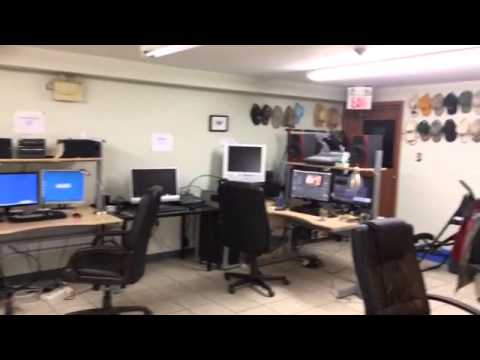
You are a GUI agent. You are given a task and a screenshot of the screen. Output one action in this format:
    pyautogui.click(x=<x>, y=<y>)
    Task: Click on the power strips
    The width and height of the screenshot is (480, 360).
    Given the screenshot: What is the action you would take?
    pyautogui.click(x=50, y=292)